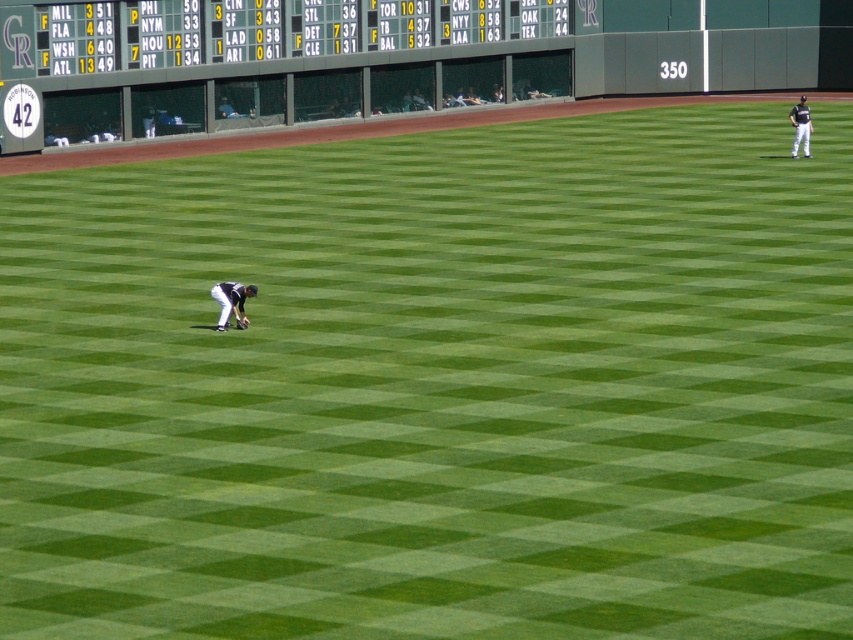
Question: Which of the following is the closest to the observer?

Choices:
 (A) black uniform at lower left
 (B) white uniform at right

Answer: (A)

Question: Considering the real-world distances, which object is closest to the dark brown leather glove at center?

Choices:
 (A) black uniform at lower left
 (B) white plastic scoreboard at upper center

Answer: (A)

Question: Which is farther from the white uniform at right?

Choices:
 (A) white plastic scoreboard at upper center
 (B) dark brown leather glove at center
 (C) black uniform at lower left

Answer: (C)

Question: Can you confirm if black uniform at lower left is thinner than white uniform at right?

Choices:
 (A) no
 (B) yes

Answer: (A)

Question: Can you confirm if white plastic scoreboard at upper center is positioned to the left of white uniform at right?

Choices:
 (A) no
 (B) yes

Answer: (B)

Question: Can you confirm if black uniform at lower left is positioned below white uniform at right?

Choices:
 (A) yes
 (B) no

Answer: (A)